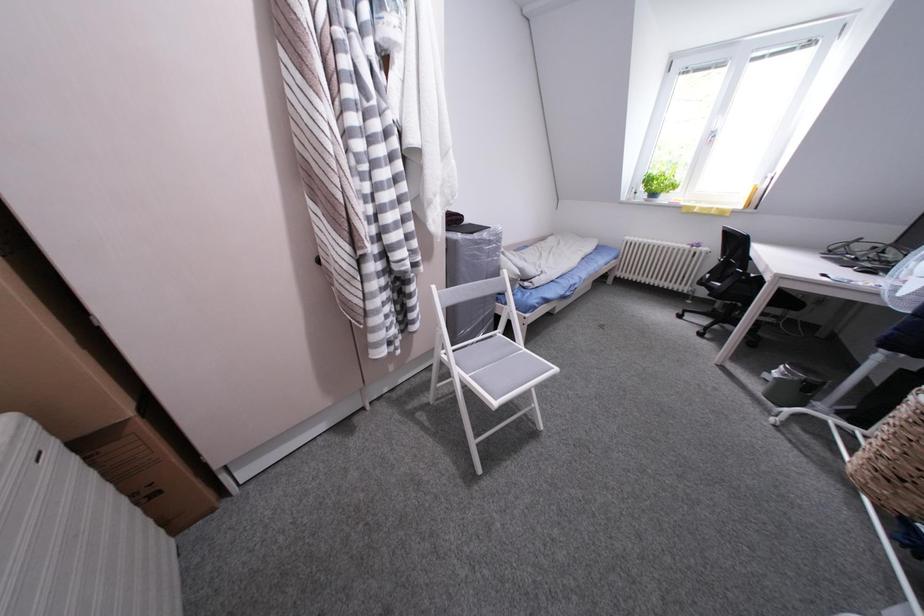
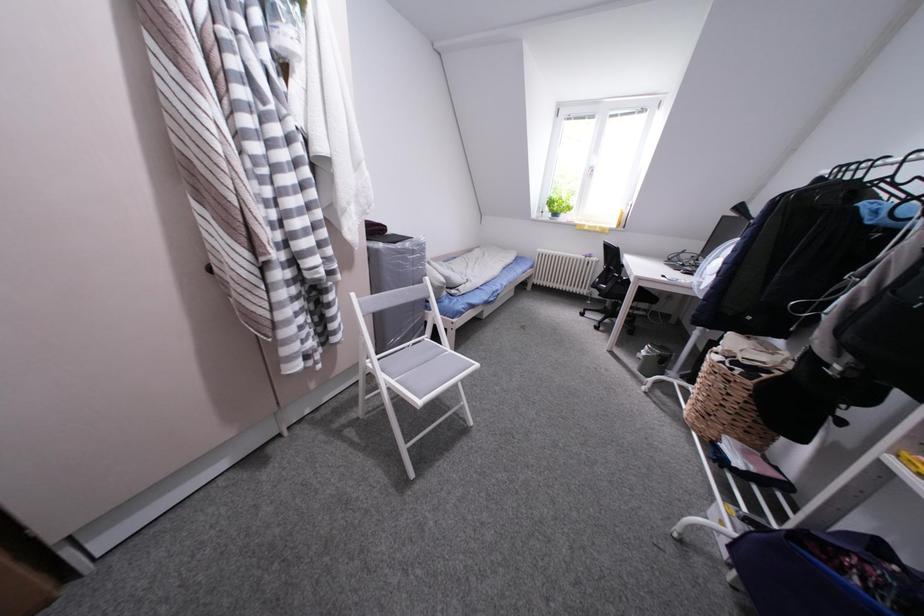
Which direction would the cameraman need to move to produce the second image?

The cameraman moved toward right, backward.